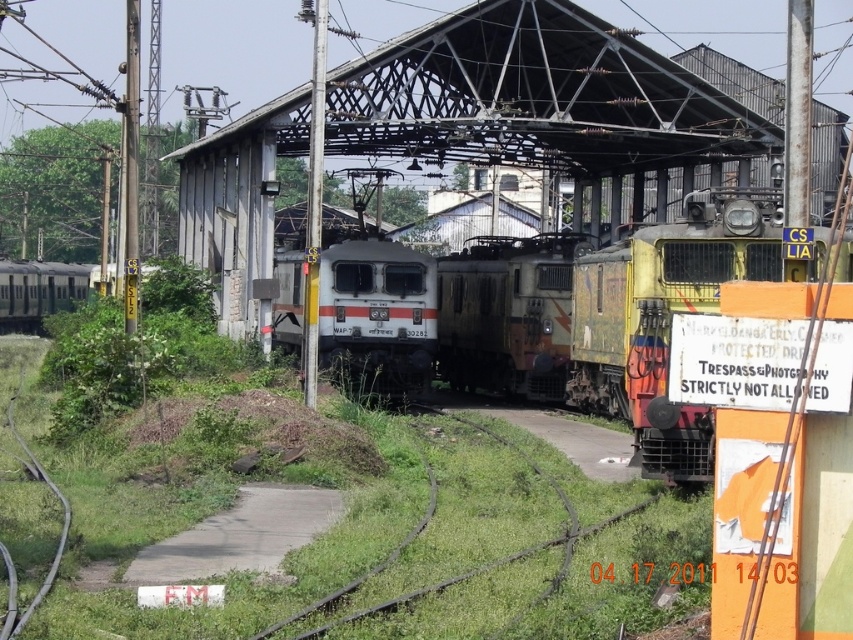
You are a passenger waiting at the railway station and want to board the train. You see the white glossy locomotive at center and the green grass train track at center. Which one is closer to you?

The white glossy locomotive at center is closer to you because the green grass train track at center is behind it.